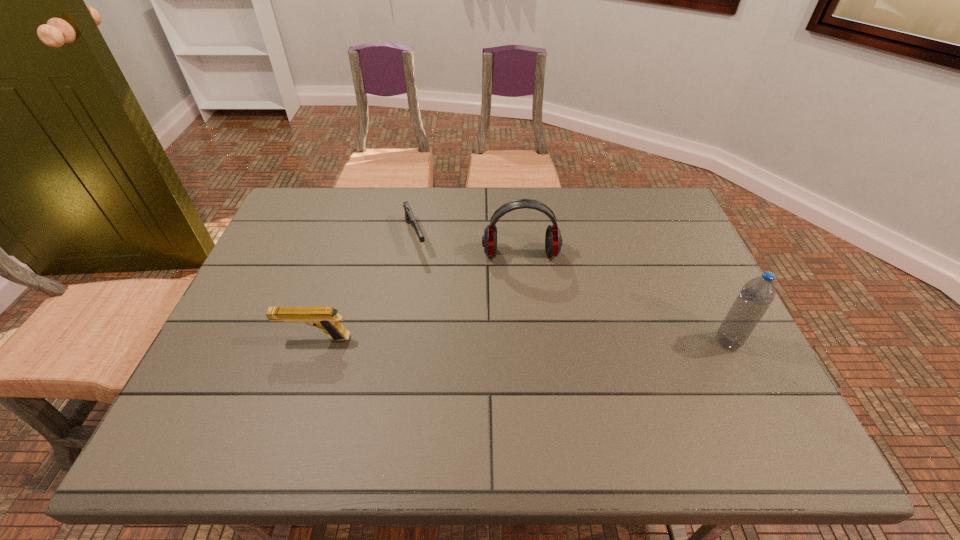
Identify the location of vacant area between the second shortest object and the gun. This screenshot has height=540, width=960. tap(365, 287).

Find the location of `empty location between the third object from left to right and the tallest object`. empty location between the third object from left to right and the tallest object is located at coordinates (624, 298).

Find the location of a particular element. vacant space that's between the shortest object and the earphone is located at coordinates (468, 245).

Find the location of a particular element. The width and height of the screenshot is (960, 540). free space between the rightmost object and the pistol is located at coordinates (521, 340).

You are a GUI agent. You are given a task and a screenshot of the screen. Output one action in this format:
    pyautogui.click(x=<x>, y=<y>)
    Task: Click on the empty space that is in between the third tallest object and the gun
    The width and height of the screenshot is (960, 540).
    Given the screenshot: What is the action you would take?
    pyautogui.click(x=365, y=287)

I want to click on free space between the third shortest object and the tallest object, so click(624, 298).

The height and width of the screenshot is (540, 960). I want to click on object identified as the closest to the tallest object, so pos(553,240).

Locate which object ranks third in proximity to the second object from right to left. Please provide its 2D coordinates. Your answer should be formatted as a tuple, i.e. [(x, y)], where the tuple contains the x and y coordinates of a point satisfying the conditions above.

[(756, 296)]